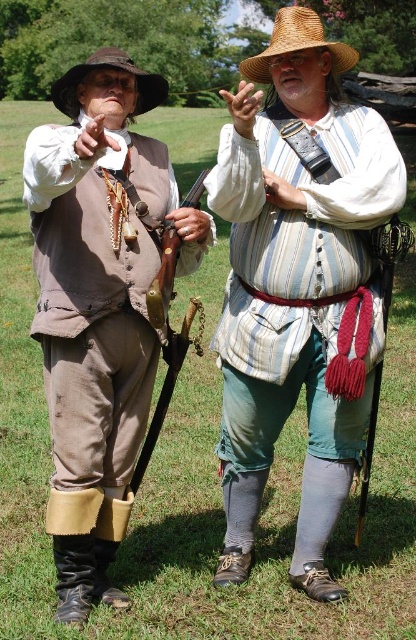
You are a tailor trying to create a replica of the historical clothing shown in the image. You have two pieces of fabric. The first is cut to match the width of the matte brown vest at left, and the second is cut to match the width of the brown felt cowboy hat at upper left. Which fabric piece is wider?

The brown felt cowboy hat at upper left is wider than the matte brown vest at left, so the fabric piece cut to match the brown felt cowboy hat at upper left is wider.

From the picture: You are an observer standing in front of the image. You notice two objects in the scene labeled as the striped fabric shirt at center and the strawhat at upper center. Which of these two objects appears taller in the image?

The striped fabric shirt at center appears taller than the strawhat at upper center in the image.